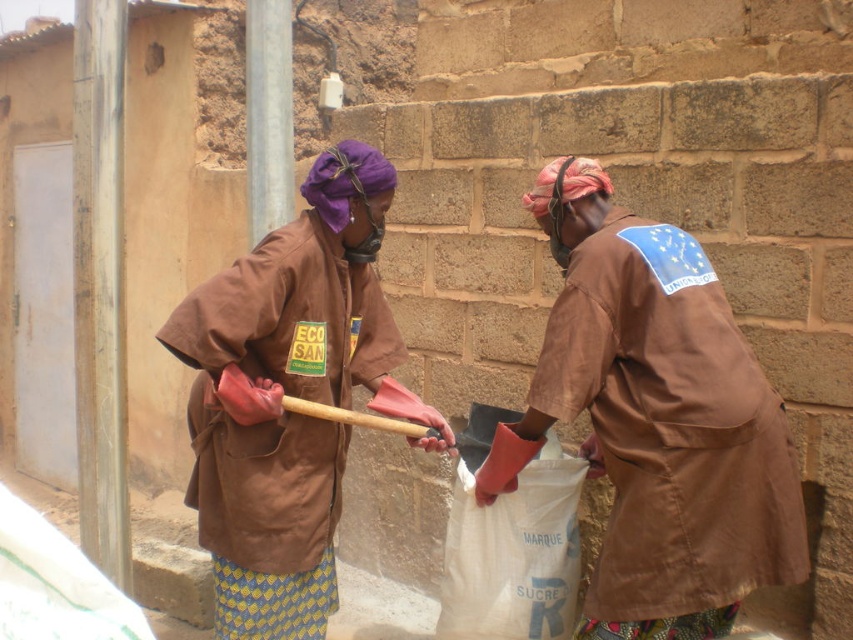
From the picture: Can you confirm if brown fabric uniform at center is positioned above brown fabric robe at right?

No, brown fabric uniform at center is not above brown fabric robe at right.

Does brown fabric uniform at center have a greater height compared to brown fabric robe at right?

Yes, brown fabric uniform at center is taller than brown fabric robe at right.

Is point (180, 324) less distant than point (718, 360)?

No.

Where is `brown fabric uniform at center`? brown fabric uniform at center is located at coordinates (657, 420).

Between brown fabric robe at right and brown fabric robe at center, which one is positioned lower?

Positioned lower is brown fabric robe at center.

Does point (567, 276) come closer to viewer compared to point (244, 467)?

No, it is not.

Identify the location of brown fabric robe at right. (668, 426).

Which of these two, brown fabric uniform at center or brown fabric robe at center, stands shorter?

brown fabric robe at center

Between point (752, 394) and point (271, 266), which one is positioned behind?

Positioned behind is point (271, 266).

Where is `brown fabric uniform at center`? This screenshot has width=853, height=640. brown fabric uniform at center is located at coordinates (657, 420).